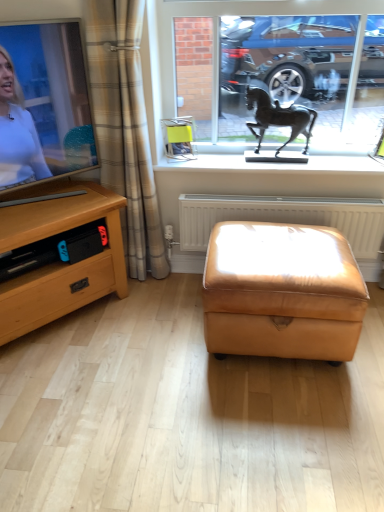
This screenshot has width=384, height=512. I want to click on vacant area that lies in front of saddle brown leather ottoman at center, so coord(269,430).